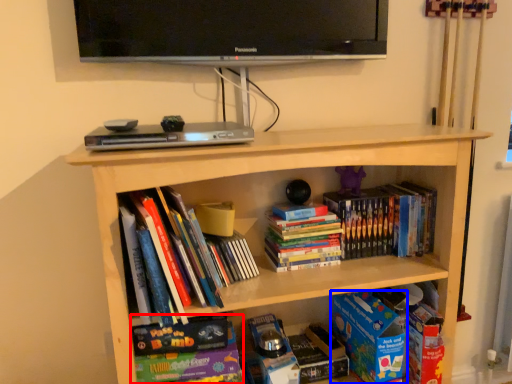
Question: Among these objects, which one is nearest to the camera, book (highlighted by a red box) or paperback book (highlighted by a blue box)?

Choices:
 (A) book
 (B) paperback book

Answer: (A)